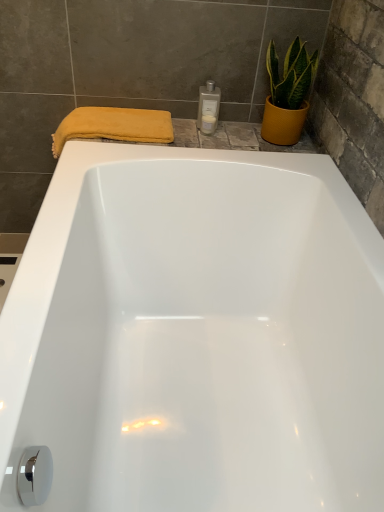
Locate an element on the screen. This screenshot has width=384, height=512. vacant region under yellow textured pot at upper right (from a real-world perspective) is located at coordinates (276, 142).